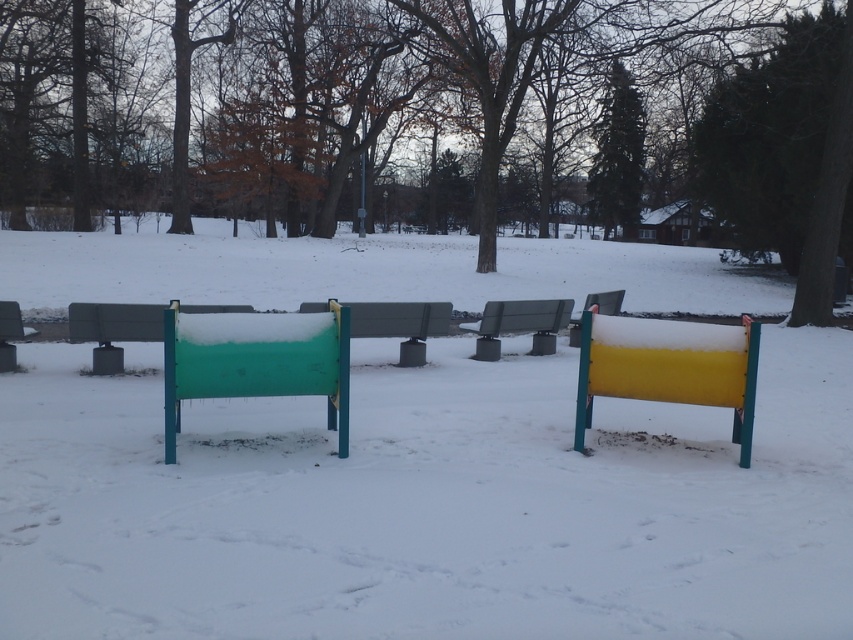
You are holding a camera and want to take a photo of the green painted wood sign at center. If you are standing 5 meters away from the sign, will you be able to capture the entire sign in your photo without moving closer?

The distance between you and the green painted wood sign at center is 4.67 meters. Since you are standing 5 meters away, which is slightly farther than the required distance, you might need to move a bit closer to ensure the entire sign fits in the photo.